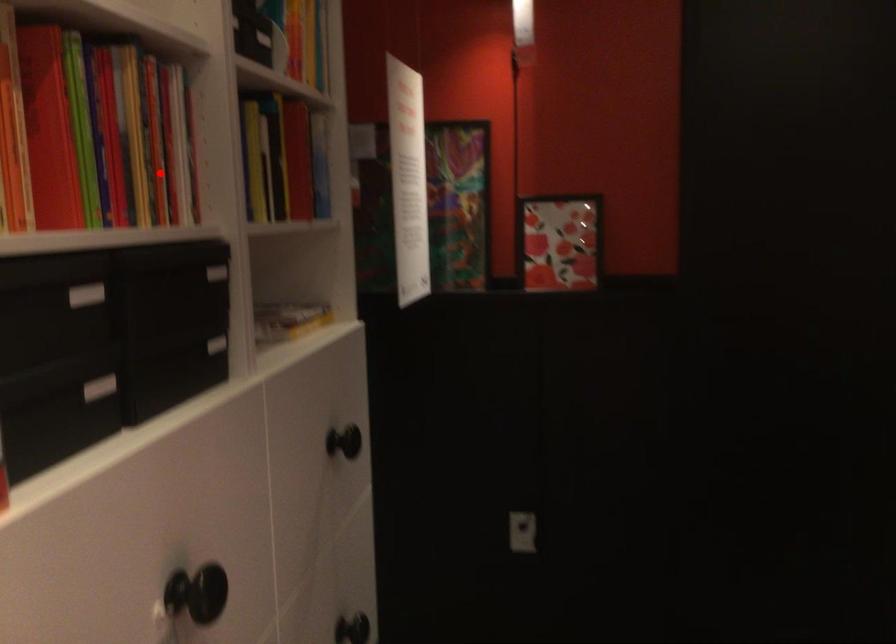
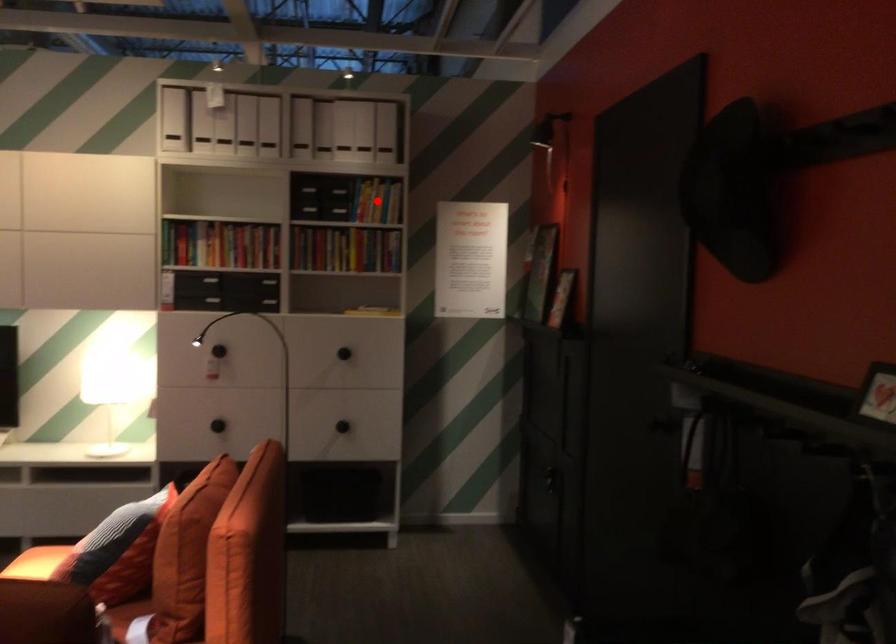
I am providing you with two images of the same scene from different viewpoints. A red point is marked on the first image and another point is marked on the second image. Is the marked point in image1 the same physical position as the marked point in image2?

No